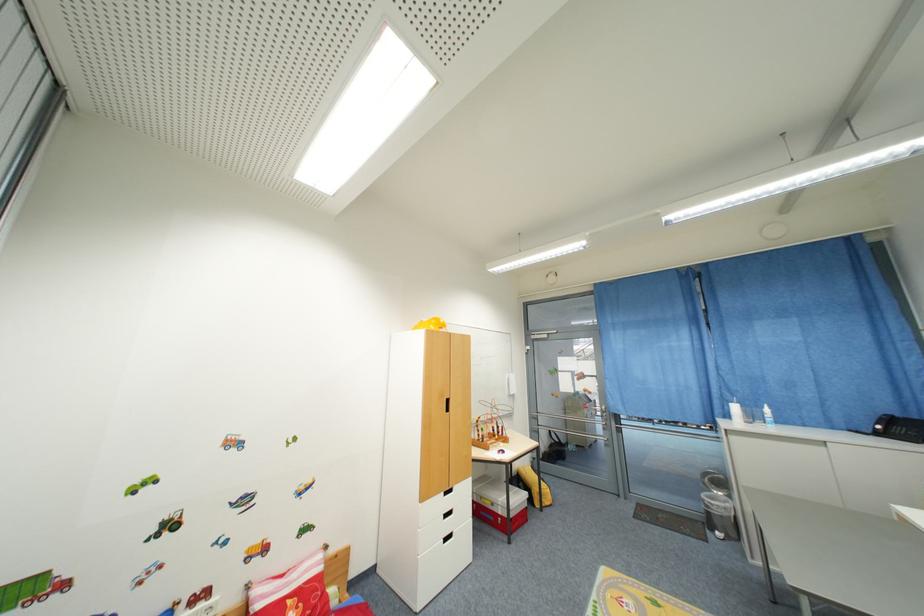
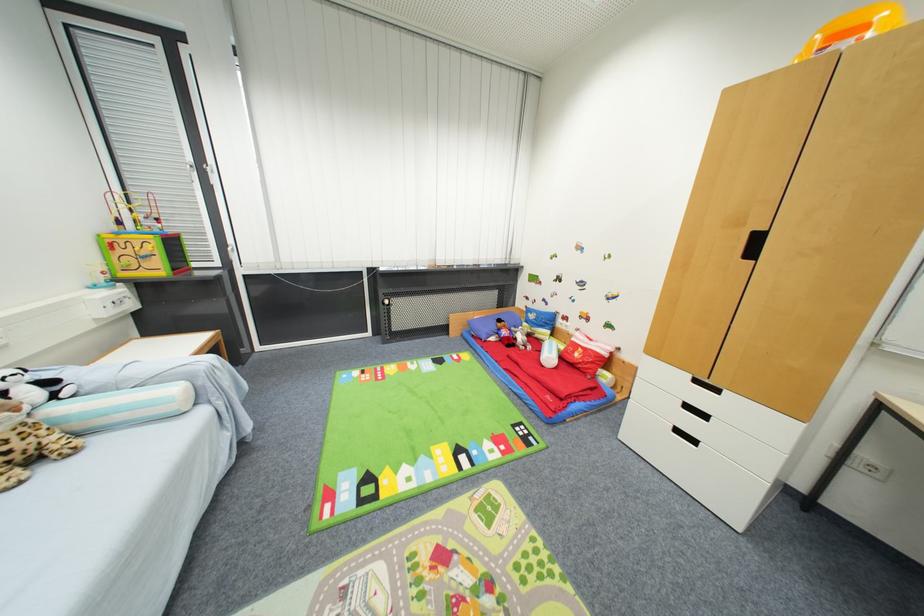
In the second image, find the point that corresponds to (x=452, y=517) in the first image.

(691, 408)